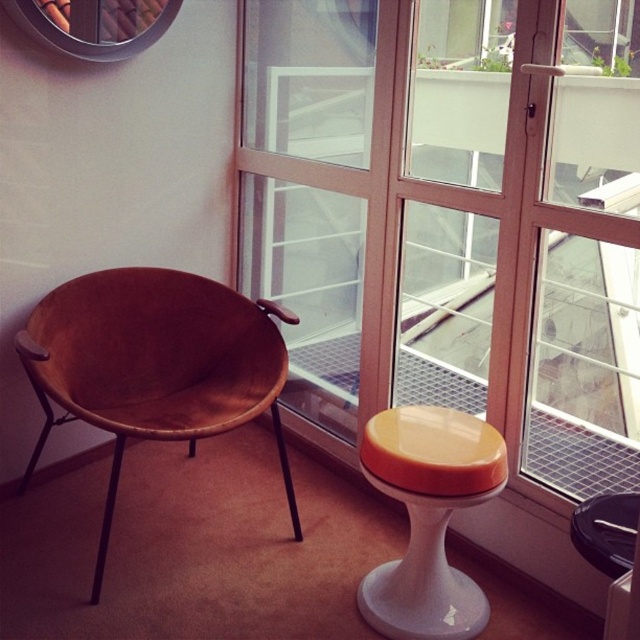
From the picture: You are a delivery robot with a package that measures 24 inches in length. You need to move from the transparent glass window at center to the orange glossy stool at lower right. Can you fit through the space between them?

The distance between the transparent glass window at center and the orange glossy stool at lower right is 23.65 inches. Since your package is 24 inches long, it is slightly longer than the available space. Therefore, you cannot fit through the space between them.

You are standing in the room and want to open the transparent glass window at center. Considering your height is 1.65 meters, can you reach the window without using a stool?

The transparent glass window at center is 1.69 meters away from the viewer. Since your height is 1.65 meters, you may not be able to reach the window without a stool as the distance is slightly greater than your height.

You are standing in the room and want to look outside through the transparent glass window at center. Which direction should you face relative to the wooden chair with a rounded backrest and armrest and the small round stool with a white base and bright orange seat?

The transparent glass window at center is located at point coordinates, so you should face toward the center of the room where the window is positioned. Since the chair is against the wall and the stool is to its right, facing the center would mean turning away from the wall and towards the middle area where the window exists.